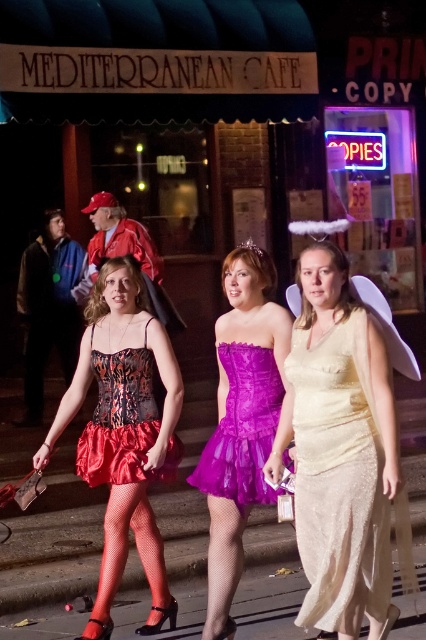
Which of these two, shiny gold dress at center or shiny satin corset at center, stands taller?

shiny gold dress at center is taller.

Is shiny gold dress at center behind shiny satin corset at center?

No, it is not.

What do you see at coordinates (340, 451) in the screenshot?
I see `shiny gold dress at center` at bounding box center [340, 451].

This screenshot has height=640, width=426. I want to click on shiny gold dress at center, so click(x=340, y=451).

Does purple satin dress at center appear on the left side of shiny satin corset at center?

Incorrect, purple satin dress at center is not on the left side of shiny satin corset at center.

Who is positioned more to the left, purple satin dress at center or shiny satin corset at center?

shiny satin corset at center is more to the left.

Image resolution: width=426 pixels, height=640 pixels. In order to click on purple satin dress at center in this screenshot , I will do `click(242, 428)`.

This screenshot has height=640, width=426. Identify the location of purple satin dress at center. (242, 428).

Is shiny red satin skirt at center to the left of smooth concrete pavement at center from the viewer's perspective?

Correct, you'll find shiny red satin skirt at center to the left of smooth concrete pavement at center.

Between shiny red satin skirt at center and smooth concrete pavement at center, which one is positioned lower?

smooth concrete pavement at center

Is point (101, 378) farther from camera compared to point (23, 636)?

No, it is not.

This screenshot has width=426, height=640. What are the coordinates of `shiny red satin skirt at center` in the screenshot? It's located at (123, 433).